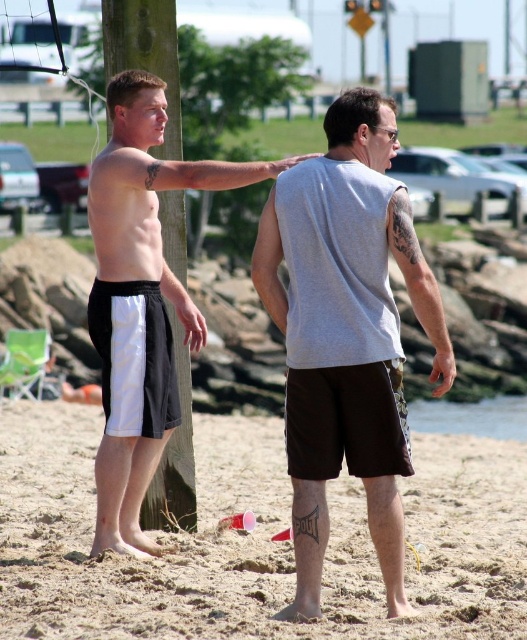
You are a photographer trying to capture a photo of the two people on the beach. You notice two specific points in the scene labeled as point 1 at coordinates point (67, 632) and point 2 at coordinates point (152, 428). Which of these points is closer to your camera lens?

Point (67, 632) is closer to the camera than point (152, 428).

Consider the image. You are standing on the sandy beach at lower center and want to see the gray matte tank top at center clearly. Which object is closer to your eye level? Please explain based on their heights.

The gray matte tank top at center is closer to your eye level because the sandy beach at lower center has a lesser height compared to it.

In the scene shown: You are standing at the camera position and want to walk to the sandy beach at lower center. How many steps would you need to take if each step covers approximately 3 feet?

The distance between the sandy beach at lower center and the camera is 22.92 feet. If each step covers 3 feet, dividing 22.92 by 3 gives approximately 7.64 steps. Since you can only take whole steps, you would need to take 8 steps to reach the sandy beach at lower center.